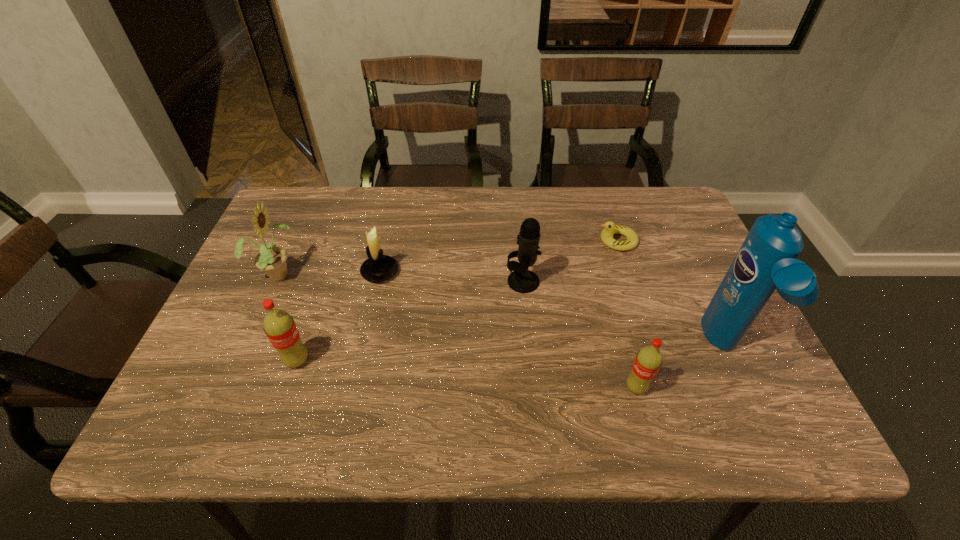
The image size is (960, 540). I want to click on shampoo, so click(767, 260).

This screenshot has width=960, height=540. I want to click on free point located 0.110m on the right of the left soda, so click(360, 361).

What are the coordinates of `free space located 0.210m on the left of the nearer soda` in the screenshot? It's located at (524, 388).

This screenshot has height=540, width=960. Identify the location of vacant space located on the front of the fourth object from left to right. (533, 390).

The height and width of the screenshot is (540, 960). Identify the location of vacant space located on the face of the duckling. (576, 241).

Identify the location of vacant point located 0.220m on the face of the duckling. tap(518, 241).

The width and height of the screenshot is (960, 540). Identify the location of vacant space located 0.050m on the face of the duckling. (579, 241).

Find the location of a particular element. Image resolution: width=960 pixels, height=540 pixels. vacant space located on the front of the fifth object from right to left is located at coordinates (362, 355).

This screenshot has height=540, width=960. In order to click on free space located on the front-facing side of the sunflower in this screenshot , I will do `click(375, 273)`.

What are the coordinates of `vacant space located 0.330m on the left of the shampoo` in the screenshot? It's located at (561, 348).